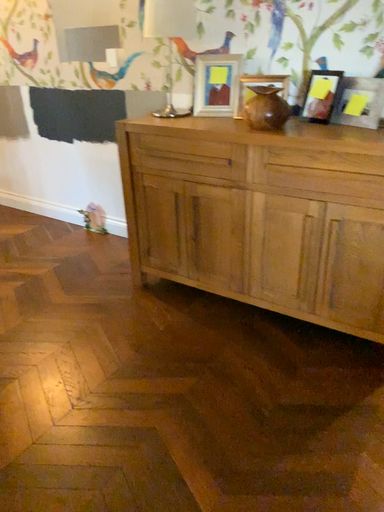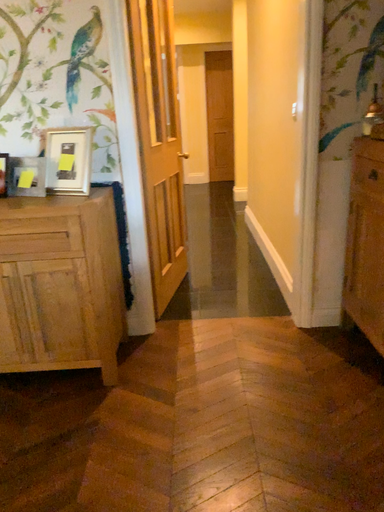
Question: Which way did the camera rotate in the video?

Choices:
 (A) rotated upward
 (B) rotated downward

Answer: (A)